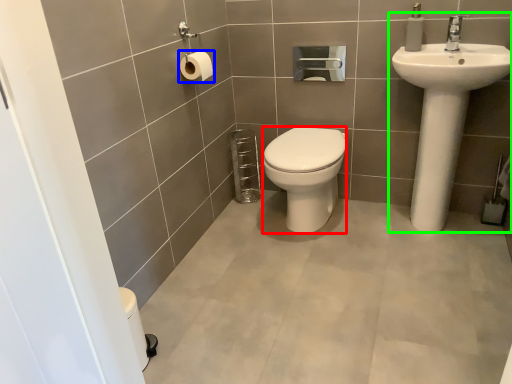
Question: Which object is the closest to the bidet (highlighted by a red box)? Choose among these: toilet paper (highlighted by a blue box) or sink (highlighted by a green box).

Choices:
 (A) toilet paper
 (B) sink

Answer: (B)